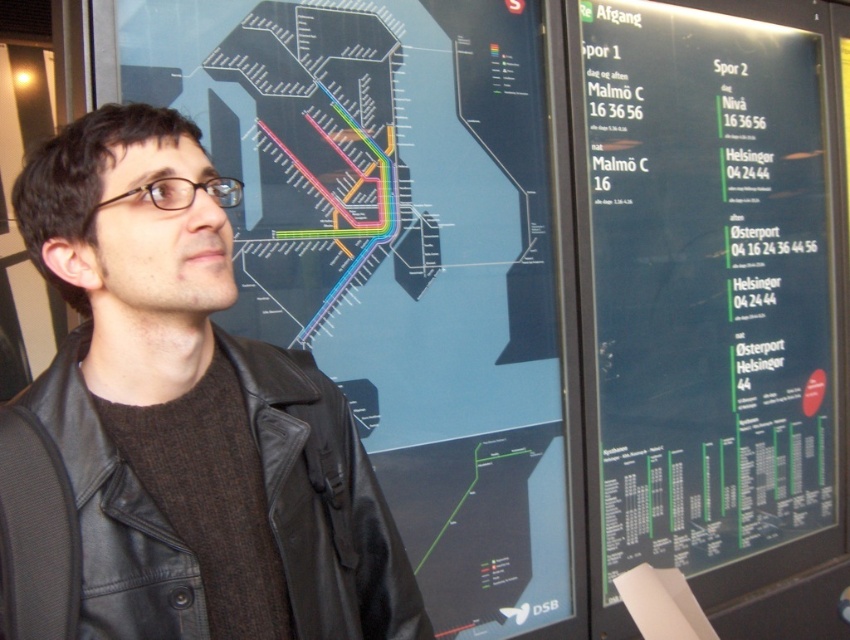
Is dark blue/black matte sign at right above black leather jacket at center?

Yes, dark blue/black matte sign at right is above black leather jacket at center.

Is dark blue/black matte sign at right closer to camera compared to black leather jacket at center?

No, it is not.

Which is behind, point (757, 166) or point (270, 461)?

Point (757, 166)

Find the location of a particular element. dark blue/black matte sign at right is located at coordinates (709, 291).

Is matte black map at upper center positioned before dark blue/black matte sign at right?

Yes.

Based on the photo, between matte black map at upper center and dark blue/black matte sign at right, which one has more height?

dark blue/black matte sign at right

Find the location of a particular element. The height and width of the screenshot is (640, 850). matte black map at upper center is located at coordinates (408, 260).

Where is `matte black map at upper center`? matte black map at upper center is located at coordinates (408, 260).

Who is shorter, matte black map at upper center or black leather jacket at center?

Standing shorter between the two is black leather jacket at center.

Who is positioned more to the right, matte black map at upper center or black leather jacket at center?

matte black map at upper center is more to the right.

Which is in front, point (477, 634) or point (281, 561)?

Point (281, 561)

Identify the location of matte black map at upper center. The width and height of the screenshot is (850, 640). (408, 260).